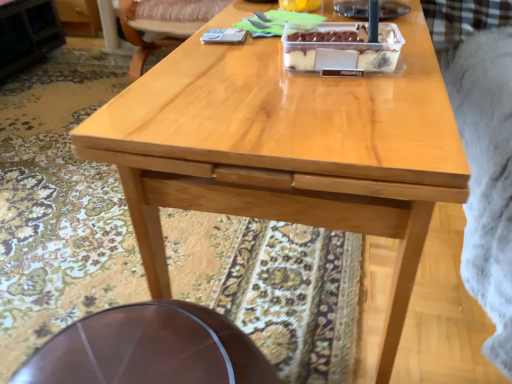
Question: Can you confirm if shiny brown table at lower center is shorter than translucent plastic container at center?

Choices:
 (A) no
 (B) yes

Answer: (A)

Question: Is the position of shiny brown table at lower center less distant than that of translucent plastic container at center?

Choices:
 (A) no
 (B) yes

Answer: (B)

Question: From a real-world perspective, is shiny brown table at lower center positioned under translucent plastic container at center based on gravity?

Choices:
 (A) yes
 (B) no

Answer: (A)

Question: Is shiny brown table at lower center with translucent plastic container at center?

Choices:
 (A) no
 (B) yes

Answer: (A)

Question: From a real-world perspective, is shiny brown table at lower center located higher than translucent plastic container at center?

Choices:
 (A) no
 (B) yes

Answer: (A)

Question: Is shiny brown table at lower center to the left or to the right of translucent plastic container at center in the image?

Choices:
 (A) right
 (B) left

Answer: (B)

Question: From their relative heights in the image, would you say shiny brown table at lower center is taller or shorter than translucent plastic container at center?

Choices:
 (A) short
 (B) tall

Answer: (B)

Question: In terms of width, does shiny brown table at lower center look wider or thinner when compared to translucent plastic container at center?

Choices:
 (A) wide
 (B) thin

Answer: (A)

Question: Is shiny brown table at lower center bigger or smaller than translucent plastic container at center?

Choices:
 (A) big
 (B) small

Answer: (A)

Question: Based on their positions, is translucent plastic container at center located to the left or right of shiny brown table at lower center?

Choices:
 (A) right
 (B) left

Answer: (A)

Question: From a real-world perspective, is translucent plastic container at center physically located above or below shiny brown table at lower center?

Choices:
 (A) below
 (B) above

Answer: (B)

Question: In terms of size, does translucent plastic container at center appear bigger or smaller than shiny brown table at lower center?

Choices:
 (A) big
 (B) small

Answer: (B)

Question: Considering the positions of translucent plastic container at center and shiny brown table at lower center in the image, is translucent plastic container at center taller or shorter than shiny brown table at lower center?

Choices:
 (A) tall
 (B) short

Answer: (B)

Question: Looking at the image, does wooden chair at upper center seem bigger or smaller compared to translucent plastic container at center?

Choices:
 (A) big
 (B) small

Answer: (A)

Question: Relative to translucent plastic container at center, is wooden chair at upper center in front or behind?

Choices:
 (A) front
 (B) behind

Answer: (B)